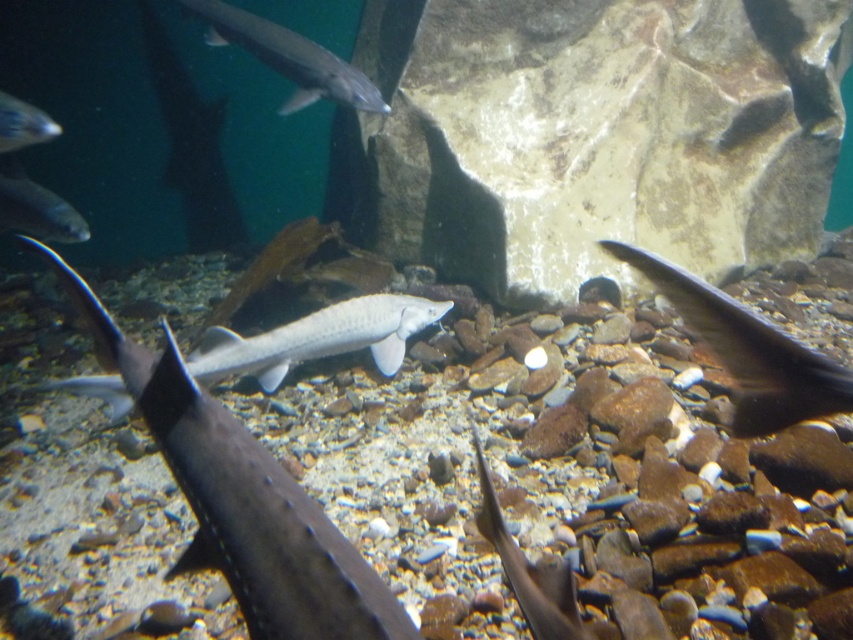
Can you confirm if white smooth fish at center is positioned below satin silver fish at lower left?

Yes.

Which is more to the left, white smooth fish at center or satin silver fish at lower left?

satin silver fish at lower left is more to the left.

What do you see at coordinates (317, 339) in the screenshot?
I see `white smooth fish at center` at bounding box center [317, 339].

Image resolution: width=853 pixels, height=640 pixels. In order to click on white smooth fish at center in this screenshot , I will do `click(317, 339)`.

Can you confirm if white smooth fish at center is positioned below translucent gray fish at center?

No.

Is point (227, 368) more distant than point (492, 538)?

Yes.

This screenshot has height=640, width=853. Identify the location of white smooth fish at center. (317, 339).

Can you confirm if smooth gray fish at center is positioned below shiny black fish at center?

Indeed, smooth gray fish at center is positioned under shiny black fish at center.

Is smooth gray fish at center further to the viewer compared to shiny black fish at center?

Yes, smooth gray fish at center is further from the viewer.

Which is behind, point (144, 396) or point (759, 419)?

Positioned behind is point (144, 396).

Find the location of `smooth gray fish at center`. smooth gray fish at center is located at coordinates (242, 499).